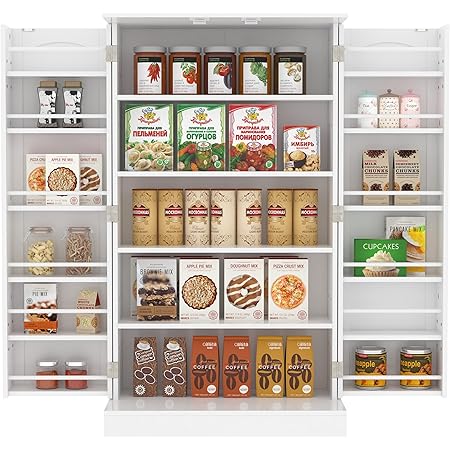
Locate an element on the screen. The image size is (450, 450). cannisters is located at coordinates (143, 221), (191, 225), (166, 232), (220, 228), (242, 228), (272, 225), (303, 225), (362, 109), (386, 108), (411, 109).